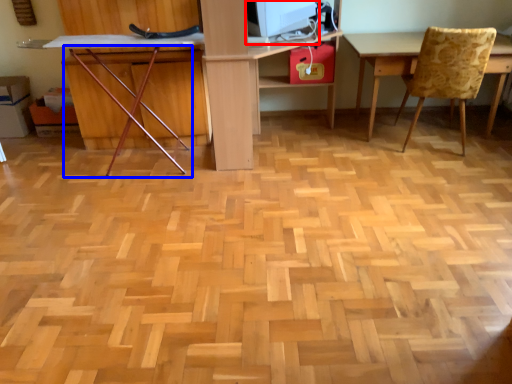
Question: Which object is closer to the camera taking this photo, computer monitor (highlighted by a red box) or chair (highlighted by a blue box)?

Choices:
 (A) computer monitor
 (B) chair

Answer: (B)